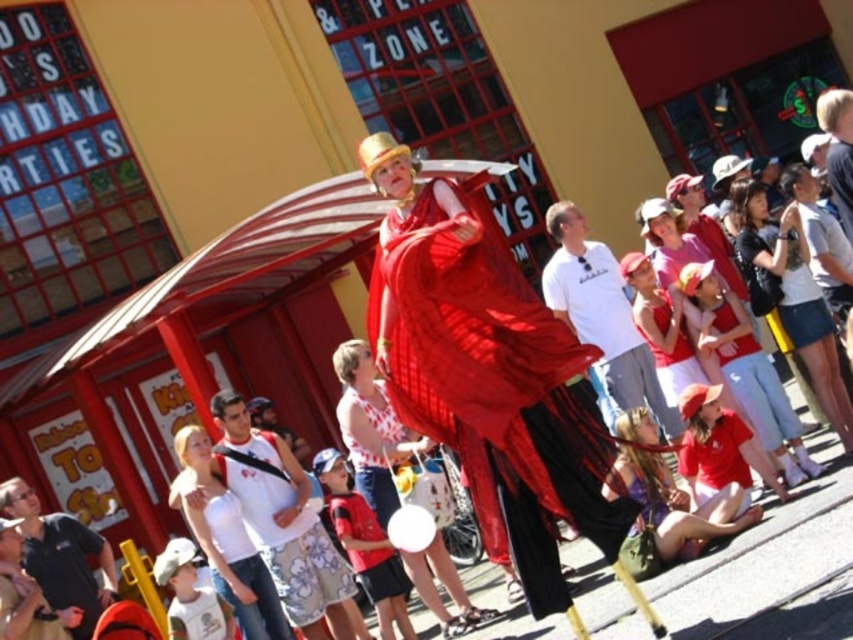
Question: Which of the following is the closest to the observer?

Choices:
 (A) matte red dress at lower center
 (B) dark blue shirt at lower left
 (C) shiny red cape at center

Answer: (C)

Question: Can you confirm if matte red dress at lower center is wider than dark blue shirt at lower left?

Choices:
 (A) no
 (B) yes

Answer: (B)

Question: Which of the following is the closest to the observer?

Choices:
 (A) shiny red cape at center
 (B) white matte tank top at center
 (C) matte red dress at lower center
 (D) matte red shirt at lower center

Answer: (A)

Question: Estimate the real-world distances between objects in this image. Which object is farther from the white cotton shirt at center?

Choices:
 (A) matte red dress at lower center
 (B) matte red shirt at lower center
 (C) dark blue shirt at lower left

Answer: (C)

Question: Can you confirm if white cotton shirt at center is positioned below matte red dress at lower center?

Choices:
 (A) yes
 (B) no

Answer: (B)

Question: From the image, what is the correct spatial relationship of shiny red cape at center in relation to white matte tank top at center?

Choices:
 (A) above
 (B) below

Answer: (A)